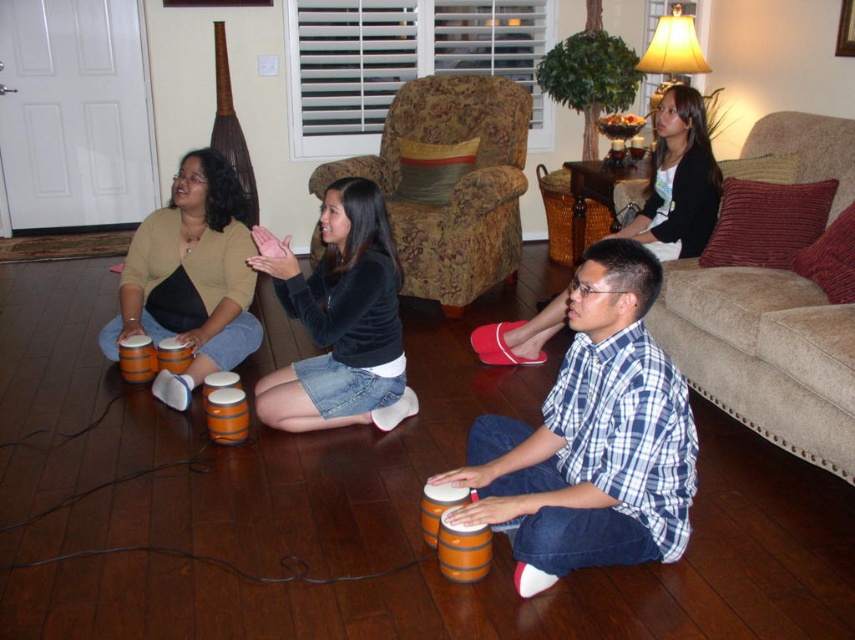
Is floral fabric armchair at center closer to the viewer compared to black matte skirt at center?

No, floral fabric armchair at center is further to the viewer.

Is floral fabric armchair at center taller than black matte skirt at center?

Indeed, floral fabric armchair at center has a greater height compared to black matte skirt at center.

This screenshot has width=855, height=640. Describe the element at coordinates (449, 182) in the screenshot. I see `floral fabric armchair at center` at that location.

Where is `floral fabric armchair at center`? This screenshot has height=640, width=855. floral fabric armchair at center is located at coordinates (449, 182).

Can you confirm if wooden bongo drum at lower center is wider than beige fabric armchair at upper right?

Indeed, wooden bongo drum at lower center has a greater width compared to beige fabric armchair at upper right.

Is wooden bongo drum at lower center closer to camera compared to beige fabric armchair at upper right?

That is True.

Where is `wooden bongo drum at lower center`? This screenshot has width=855, height=640. wooden bongo drum at lower center is located at coordinates (593, 438).

Who is shorter, wooden bongo drum at lower center or matte orange bongo drums at left?

Standing shorter between the two is wooden bongo drum at lower center.

Consider the image. Does wooden bongo drum at lower center appear on the right side of matte orange bongo drums at left?

Indeed, wooden bongo drum at lower center is positioned on the right side of matte orange bongo drums at left.

Is point (667, 536) farther from camera compared to point (116, 356)?

No, it is not.

The image size is (855, 640). I want to click on wooden bongo drum at lower center, so click(x=593, y=438).